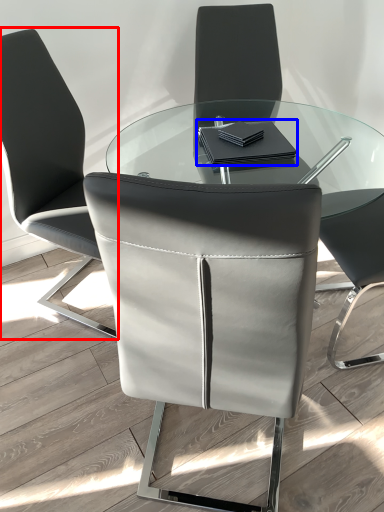
Question: Which of the following is the closest to the observer, chair (highlighted by a red box) or notebook (highlighted by a blue box)?

Choices:
 (A) chair
 (B) notebook

Answer: (A)